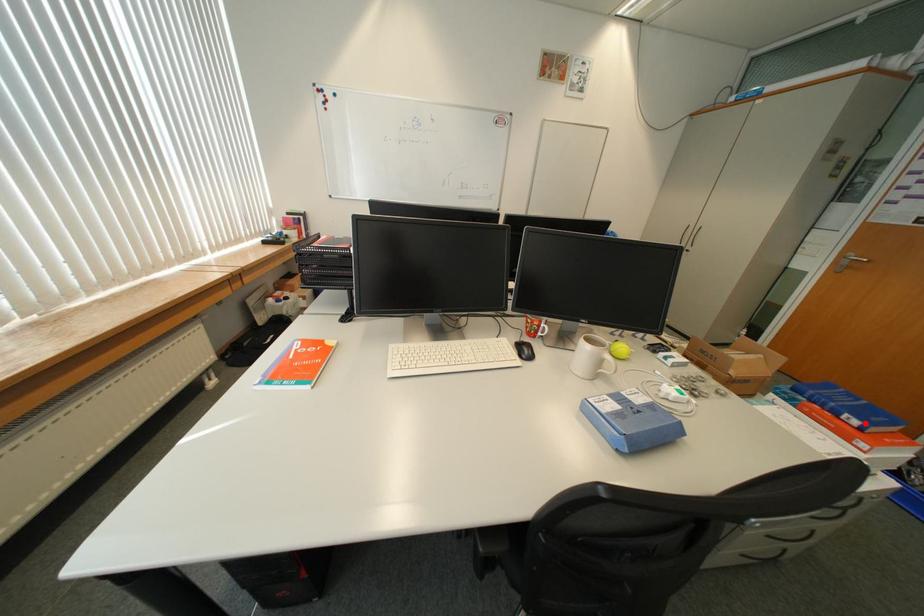
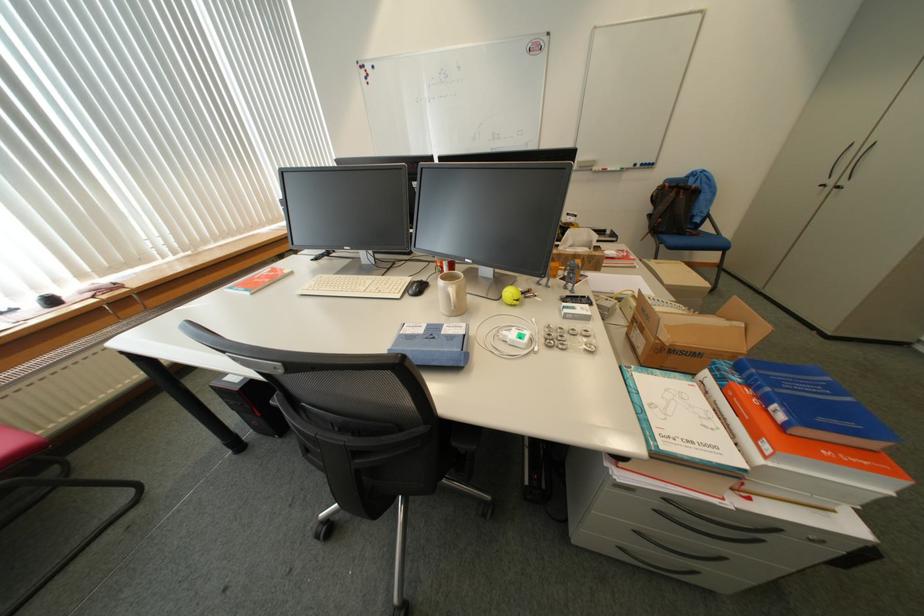
The point at the highlighted location is marked in the first image. Where is the corresponding point in the second image?

(791, 418)